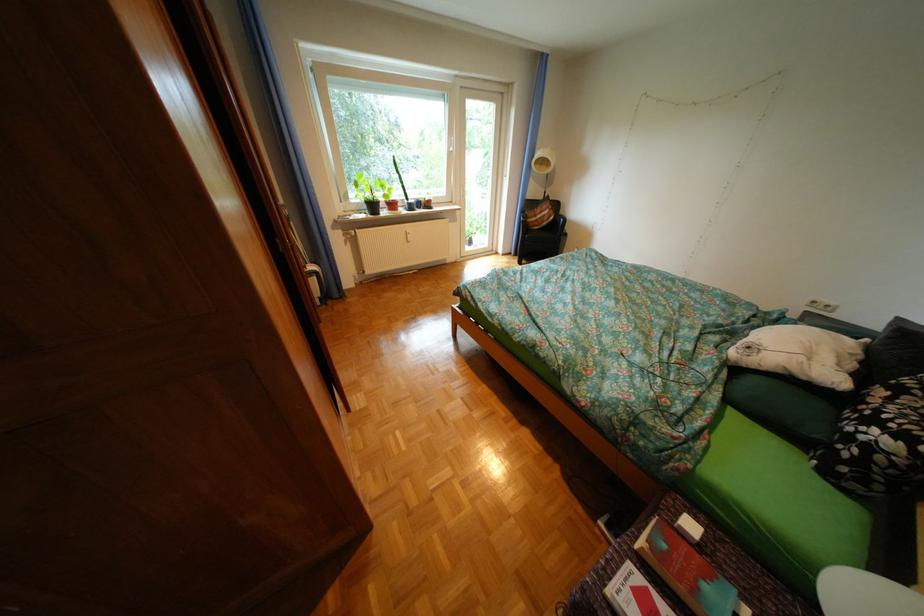
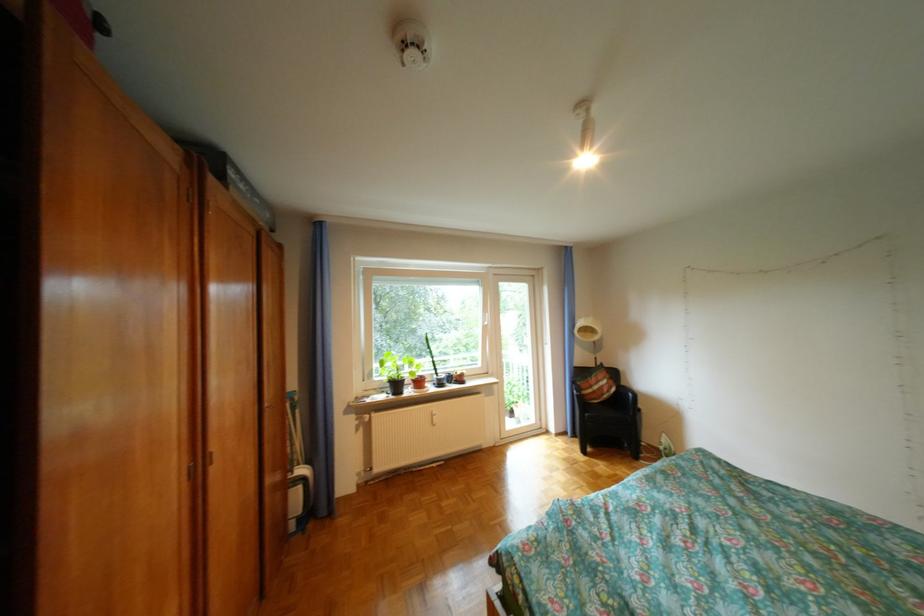
Find the pixel in the second image that matches (x=380, y=207) in the first image.

(403, 386)